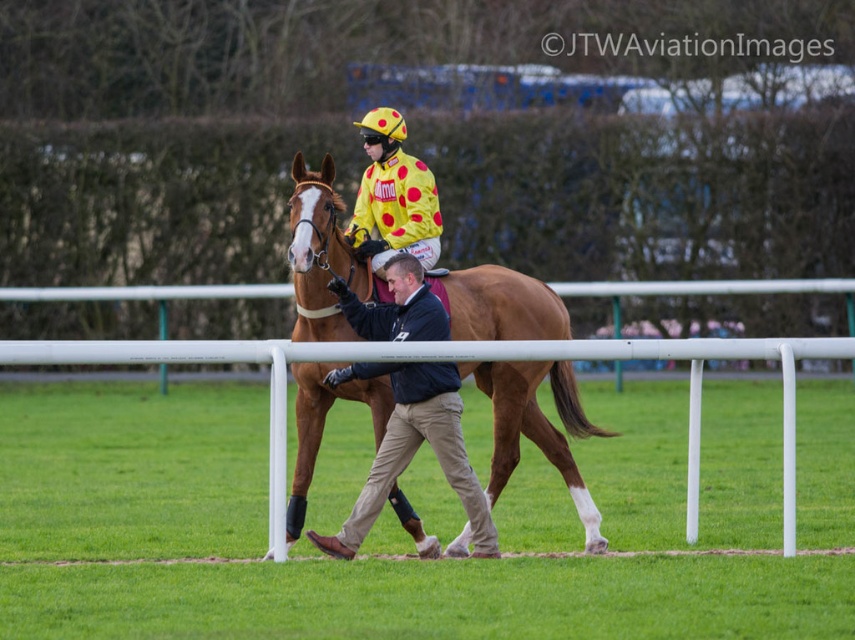
You are standing at the starting line of the horse racing track and want to reach the point at coordinates point (629, 292). If your maximum walking distance is 70 feet, can you reach it without exceeding your limit?

The distance of point (629, 292) from viewer is 73.24 feet, which exceeds your maximum walking distance of 70 feet. Therefore, you cannot reach it without exceeding your limit.

You are standing at the point labeled as point (485, 284) on the horse racing track. A photographer wants to take a picture of the scene from your current position. The photographer is 5 feet tall and needs to know if they can see the entire horse and rider without any obstructions. The horse is 16 hands tall, and the rider is sitting 2 feet higher than the horse. The photographer is using a camera with a 50mm lens. Can they capture the entire scene from this position?

The photographer is 43.72 feet away from point (485, 284). The horse is 16 hands tall, which is approximately 64 inches, and the rider adds an additional 2 feet, totaling 88 inches. Using a 50mm lens, the photographer can capture the entire scene as the height required would be within the lens capabilities at that distance.

You are a photographer positioned at the edge of the horse racing track. You need to capture a photo where the dark blue jacket at center and the yellow dotted fabric at center are clearly visible. Based on their positions, which one will appear larger in the photo?

The dark blue jacket at center is taller than the yellow dotted fabric at center, so it will appear larger in the photo.